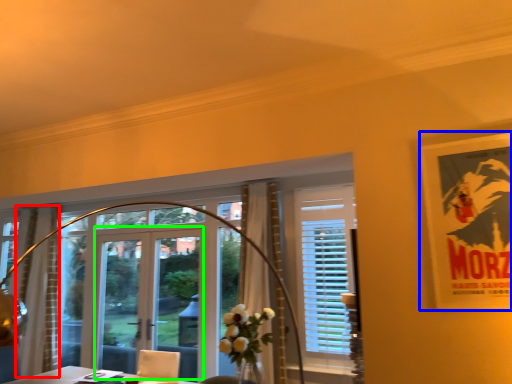
Question: Estimate the real-world distances between objects in this image. Which object is farther from curtain (highlighted by a red box), poster page (highlighted by a blue box) or screen door (highlighted by a green box)?

Choices:
 (A) poster page
 (B) screen door

Answer: (A)